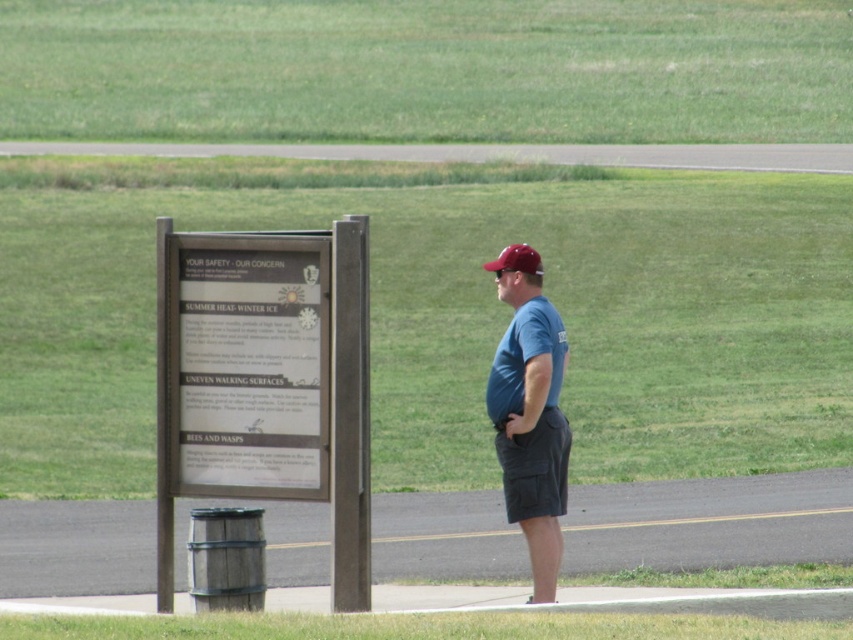
Question: Estimate the real-world distances between objects in this image. Which object is closer to the blue cotton shirt at center?

Choices:
 (A) maroon matte baseball cap at center
 (B) brushed metal sign at left
 (C) dark gray cotton shorts at right

Answer: (C)

Question: Considering the relative positions of blue cotton shirt at center and dark gray cotton shorts at right in the image provided, where is blue cotton shirt at center located with respect to dark gray cotton shorts at right?

Choices:
 (A) right
 (B) left

Answer: (A)

Question: Which point is farther to the camera?

Choices:
 (A) dark gray cotton shorts at right
 (B) maroon matte baseball cap at center

Answer: (A)

Question: Can you confirm if dark gray cotton shorts at right is bigger than maroon matte baseball cap at center?

Choices:
 (A) no
 (B) yes

Answer: (A)

Question: Does blue cotton shirt at center appear over dark gray cotton shorts at right?

Choices:
 (A) no
 (B) yes

Answer: (B)

Question: Among these points, which one is nearest to the camera?

Choices:
 (A) (325, 387)
 (B) (544, 470)
 (C) (525, 404)
 (D) (498, 262)

Answer: (A)